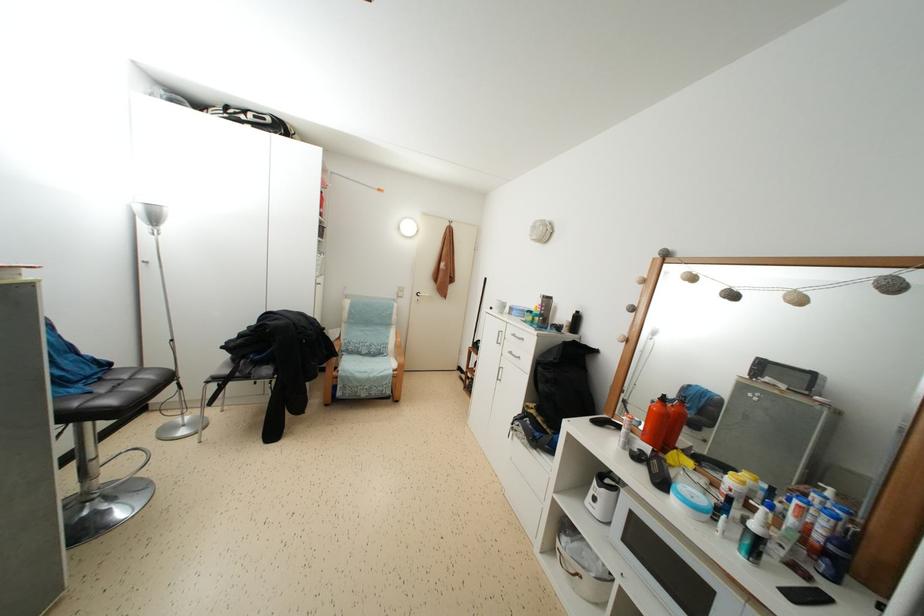
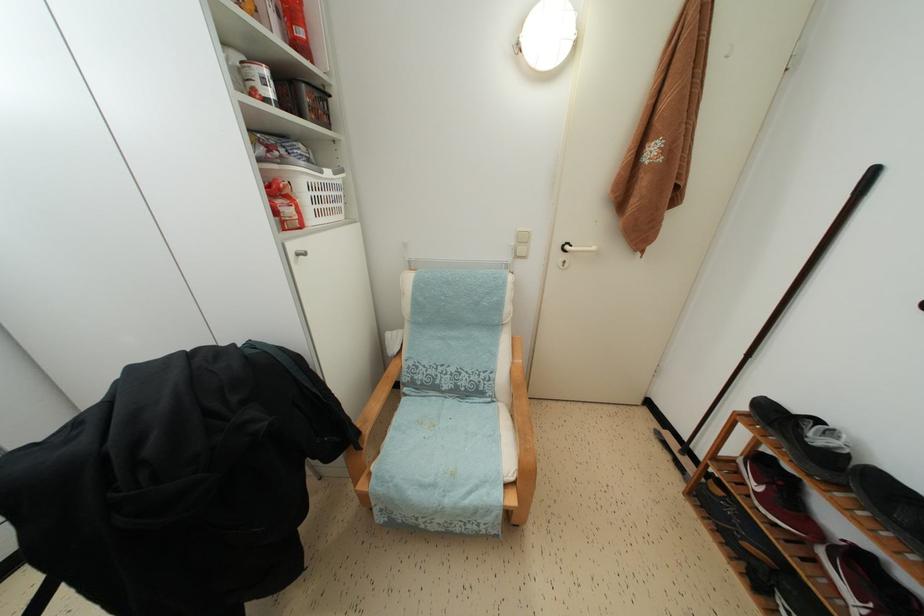
Find the pixel in the second image that matches point 468,382 in the first image.

(678, 450)